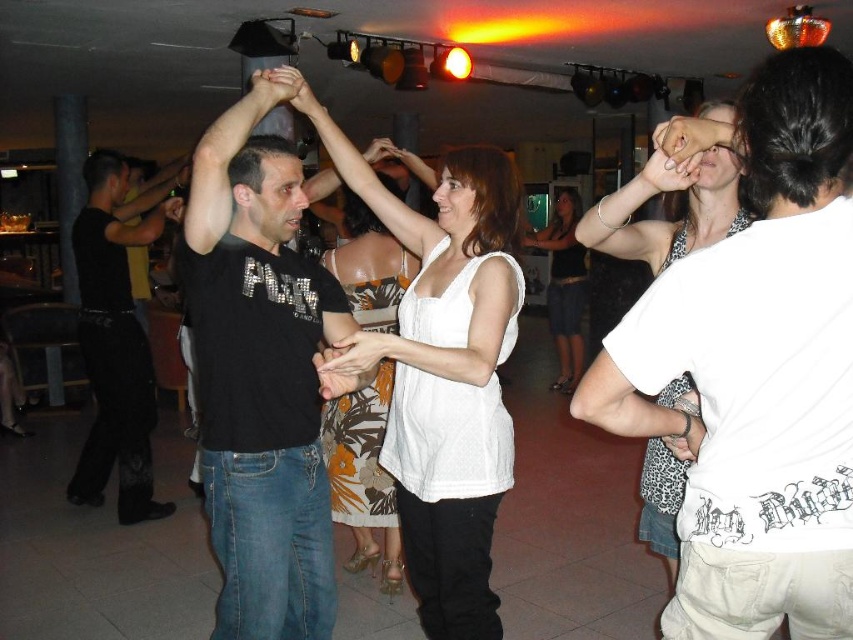
Question: Which of the following is the farthest from the observer?

Choices:
 (A) white matte tank top at center
 (B) white printed t-shirt at upper right
 (C) white fabric blouse at center

Answer: (A)

Question: Based on their relative distances, which object is farther from the black matte t-shirt at center?

Choices:
 (A) white matte tank top at center
 (B) white fabric dress at center
 (C) white fabric blouse at center
 (D) white printed t-shirt at upper right

Answer: (B)

Question: Among these points, which one is nearest to the camera?

Choices:
 (A) (341, 445)
 (B) (550, 333)
 (C) (241, 534)

Answer: (C)

Question: Can you confirm if white fabric blouse at center is positioned to the right of black smooth pants at left?

Choices:
 (A) yes
 (B) no

Answer: (A)

Question: Is black matte t-shirt at center below white printed t-shirt at upper right?

Choices:
 (A) no
 (B) yes

Answer: (B)

Question: Observing the image, what is the correct spatial positioning of white matte tank top at center in reference to white printed t-shirt at upper right?

Choices:
 (A) above
 (B) below

Answer: (B)